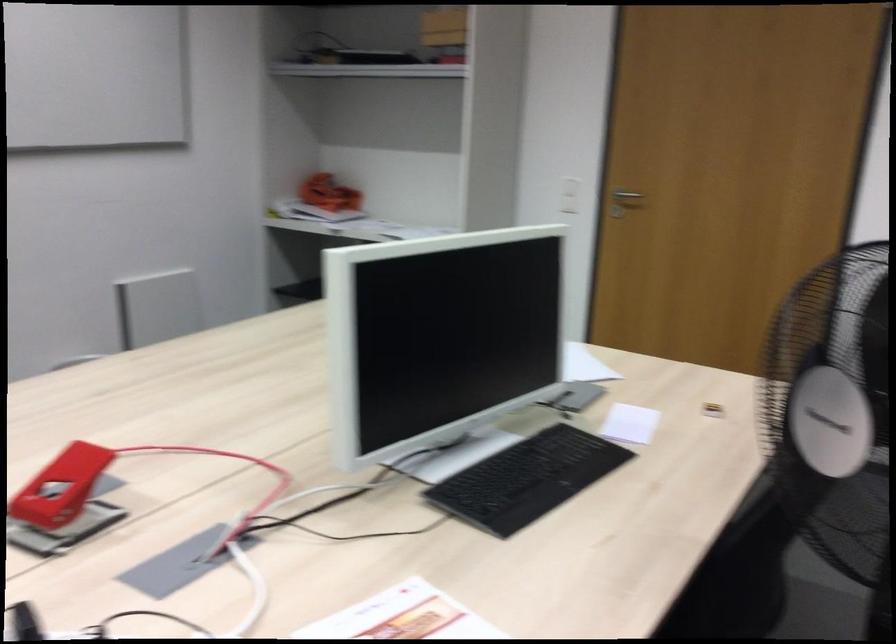
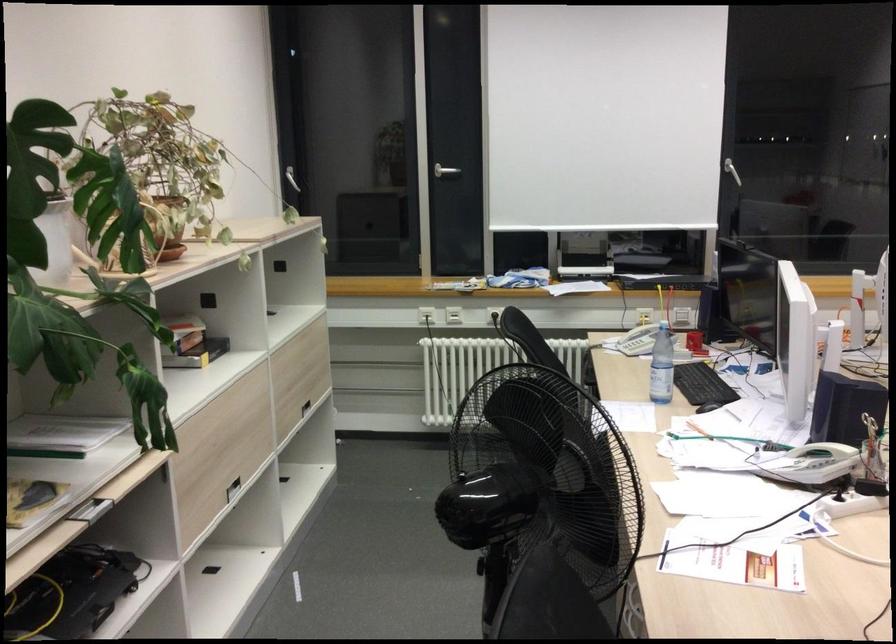
Question: I am providing you with two images of the same scene from different viewpoints. Which of the following objects are not visible in image2?

Choices:
 (A) stack of books
 (B) white fan knob
 (C) silver door handle
 (D) white towel tag

Answer: (B)